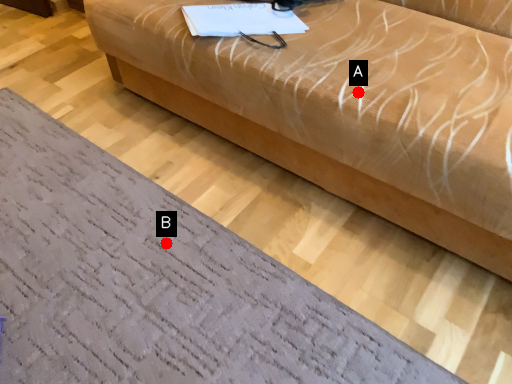
Question: Two points are circled on the image, labeled by A and B beside each circle. Which point is farther from the camera taking this photo?

Choices:
 (A) A is further
 (B) B is further

Answer: (B)